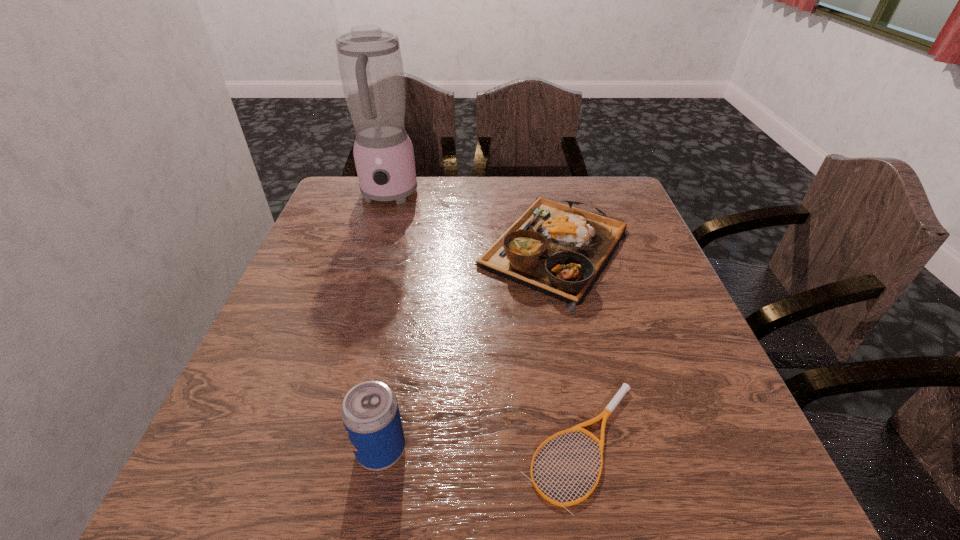
Image resolution: width=960 pixels, height=540 pixels. I want to click on vacant space at the far right corner, so click(621, 220).

Locate an element on the screen. free space between the beer can and the tennis racket is located at coordinates (482, 447).

Find the location of a particular element. The height and width of the screenshot is (540, 960). free space between the shortest object and the third shortest object is located at coordinates (482, 447).

Where is `vacant space that is in between the second tallest object and the second shortest object`? This screenshot has width=960, height=540. vacant space that is in between the second tallest object and the second shortest object is located at coordinates (468, 349).

Where is `vacant space that's between the beer can and the tennis racket`? The height and width of the screenshot is (540, 960). vacant space that's between the beer can and the tennis racket is located at coordinates (482, 447).

Find the location of `empty space that is in between the third tallest object and the second tallest object`. empty space that is in between the third tallest object and the second tallest object is located at coordinates (468, 349).

Image resolution: width=960 pixels, height=540 pixels. I want to click on free space between the beer can and the shortest object, so click(482, 447).

Where is `free area in between the second tallest object and the shortest object`? The height and width of the screenshot is (540, 960). free area in between the second tallest object and the shortest object is located at coordinates (482, 447).

Locate an element on the screen. The height and width of the screenshot is (540, 960). unoccupied position between the beer can and the shortest object is located at coordinates (482, 447).

In order to click on vacant space that is in between the shortest object and the third tallest object in this screenshot , I will do `click(567, 346)`.